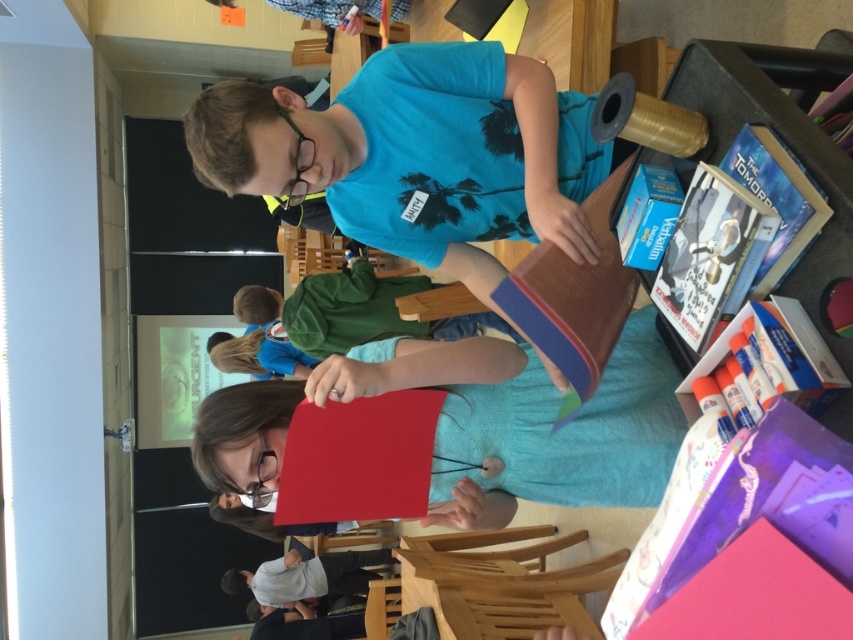
From the picture: You are a student in the classroom and need to locate the smooth red paper at center. Where exactly is it positioned in the room?

The smooth red paper at center is located at the 2D coordinates point (473, 424) in the room.

You are a student in the classroom and need to place both the smooth red paper at center and the light gray cotton shirt at lower center on a desk that can only accommodate one of them. Based on their sizes, which object should you prioritize placing first?

The smooth red paper at center has a smaller size compared to the light gray cotton shirt at lower center, so you should prioritize placing the light gray cotton shirt at lower center first since it requires more space.